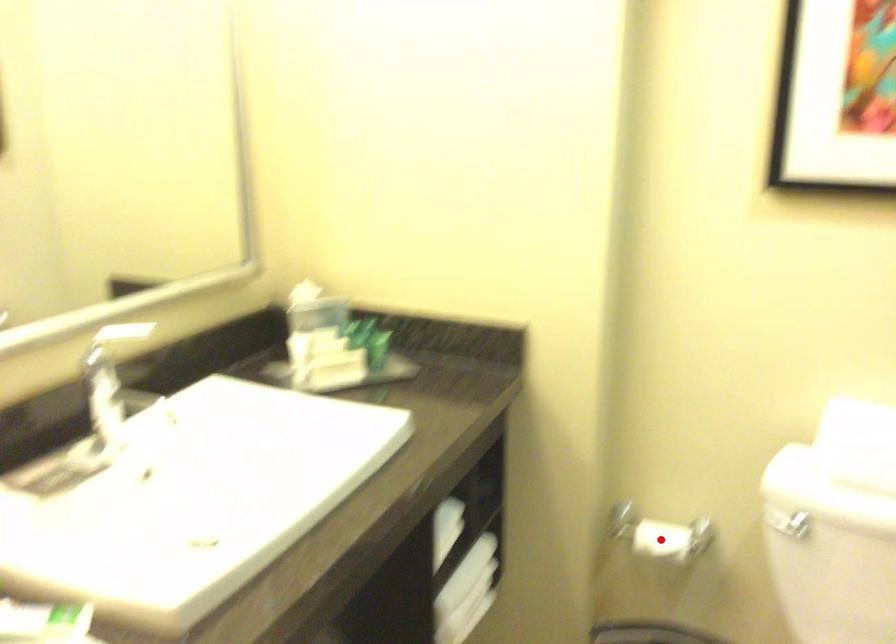
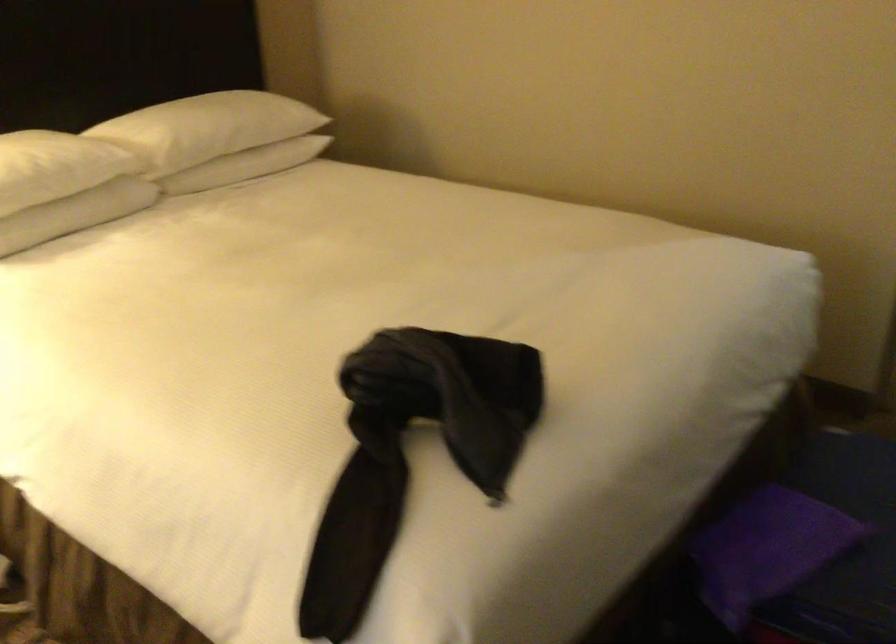
Question: I am providing you with two images of the same scene from different viewpoints. A red point is marked on the first image. At the location where the point appears in image 1, is it still visible in image 2?

Choices:
 (A) Yes
 (B) No

Answer: (B)